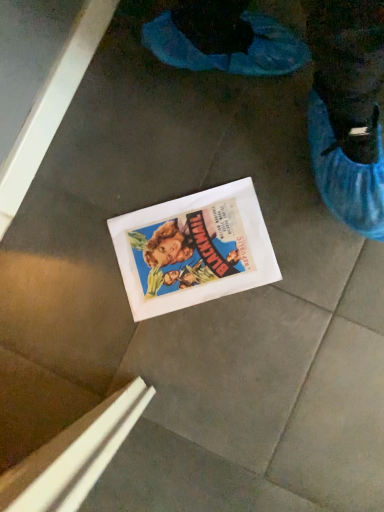
Identify the location of free space above white paper comic book at center (from a real-world perspective). The width and height of the screenshot is (384, 512). (x=190, y=252).